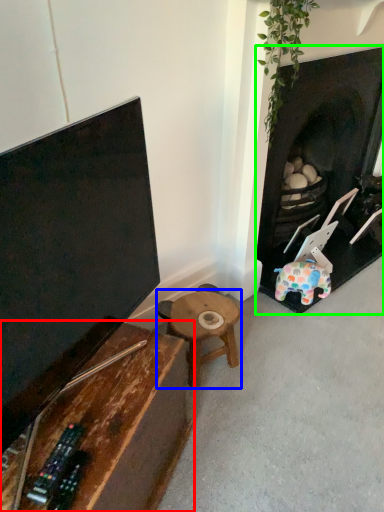
Question: Estimate the real-world distances between objects in this image. Which object is farther from table (highlighted by a red box), table (highlighted by a blue box) or fireplace (highlighted by a green box)?

Choices:
 (A) table
 (B) fireplace

Answer: (B)